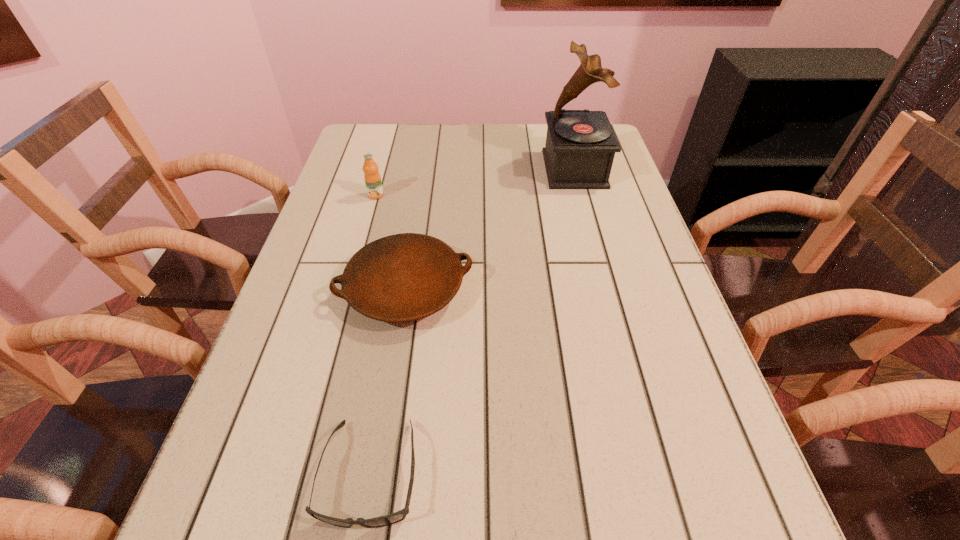
At what (x,y) coordinates should I click in order to perform the action: click on the tallest object. Please return your answer as a coordinate pair (x, y). Looking at the image, I should click on (580, 147).

Image resolution: width=960 pixels, height=540 pixels. Identify the location of the rightmost object. coord(580,147).

Locate an element on the screen. orange juice is located at coordinates (372, 178).

The image size is (960, 540). Identify the location of the third nearest object. (372, 178).

This screenshot has height=540, width=960. I want to click on plate, so click(x=405, y=277).

Locate an element on the screen. the second shortest object is located at coordinates (405, 277).

The width and height of the screenshot is (960, 540). Identify the location of the shortest object. (398, 516).

This screenshot has width=960, height=540. I want to click on the nearest object, so click(398, 516).

At what (x,y) coordinates should I click in order to perform the action: click on vacant area situated 0.340m at the horn opening of the tallest object. Please return your answer as a coordinate pair (x, y). Looking at the image, I should click on (425, 169).

Find the location of a particular element. This screenshot has height=540, width=960. vacant space situated 0.210m at the horn opening of the tallest object is located at coordinates click(x=471, y=169).